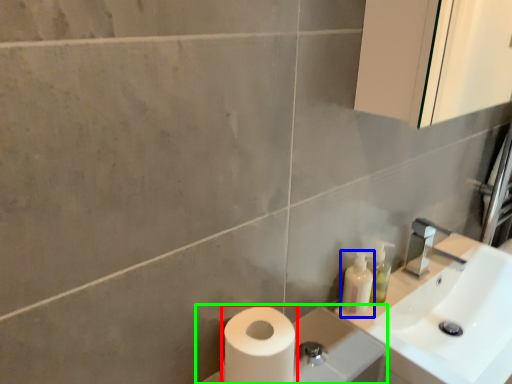
Question: Considering the real-world distances, which object is closest to toilet paper (highlighted by a red box)? toiletry (highlighted by a blue box) or porcelain (highlighted by a green box).

Choices:
 (A) toiletry
 (B) porcelain

Answer: (B)